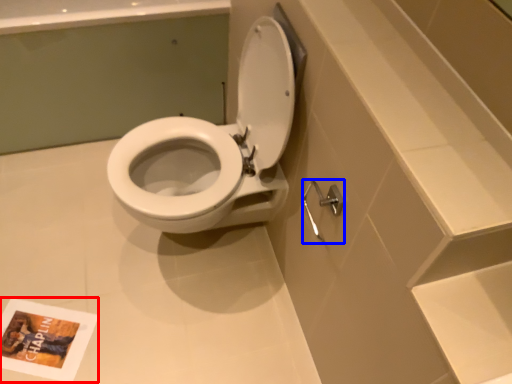
Question: Among these objects, which one is nearest to the camera, book cover (highlighted by a red box) or shower (highlighted by a blue box)?

Choices:
 (A) book cover
 (B) shower

Answer: (B)